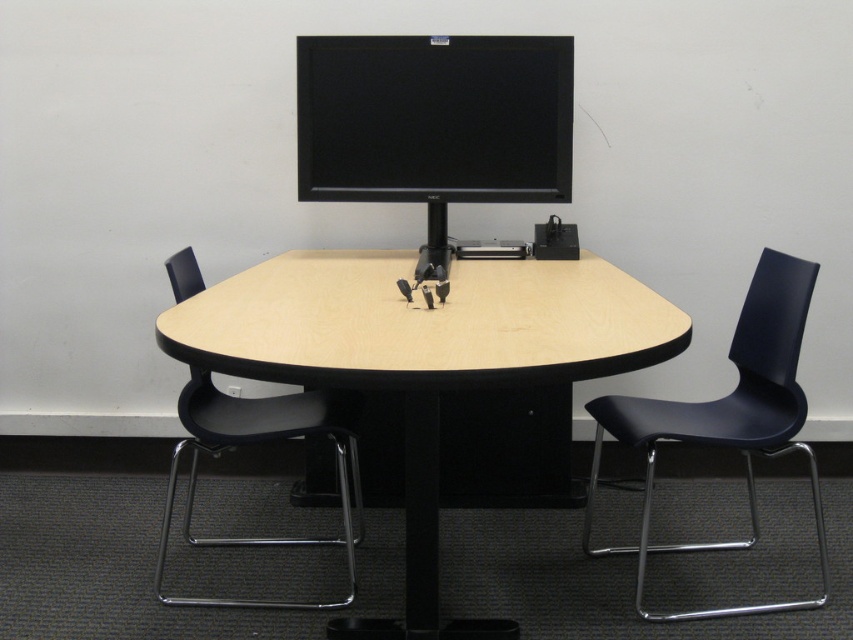
You are sitting in the black plastic swivel chair at lower left and want to look at the black matte monitor at upper center. In which direction should you turn your head to see it?

The black matte monitor at upper center is to the right of the black plastic swivel chair at lower left, so you should turn your head to the right to see it.

You are organizing a meeting in the office. The black matte monitor at upper center and the black plastic chair at right are both on the table. Which object is wider?

The black matte monitor at upper center is wider than the black plastic chair at right.

You are standing in the office and want to reach the black matte monitor at upper center. The room has a 6.5 feet wide door. Can you walk through the door while holding the monitor upright without tilting it?

The distance between you and the black matte monitor at upper center is 7.84 feet. Since the door is 6.5 feet wide, the monitor is wider than the door. Therefore, you cannot walk through the door while holding the monitor upright without tilting it.